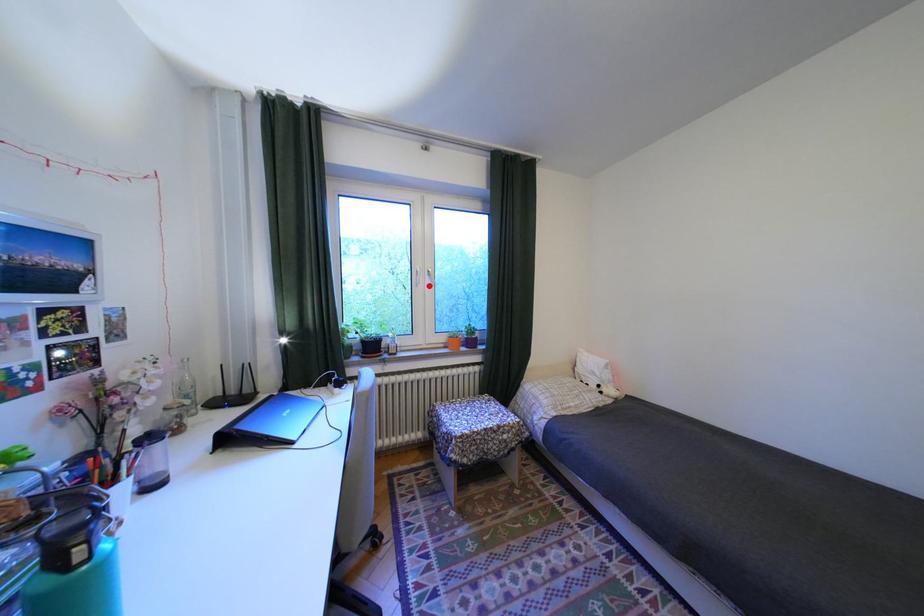
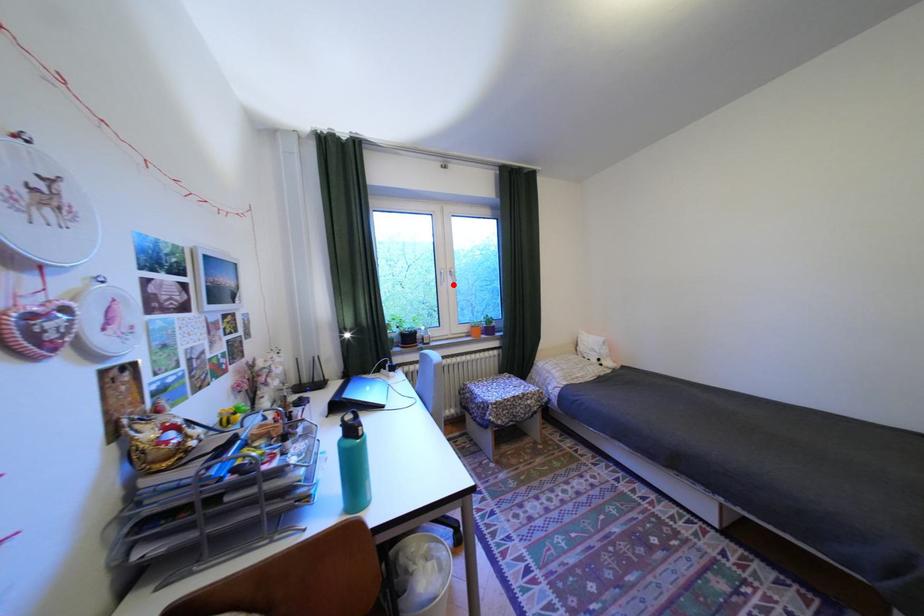
I am providing you with two images of the same scene from different viewpoints. A red point is marked on the first image and another point is marked on the second image. Does the point marked in image1 correspond to the same location as the one in image2?

Yes